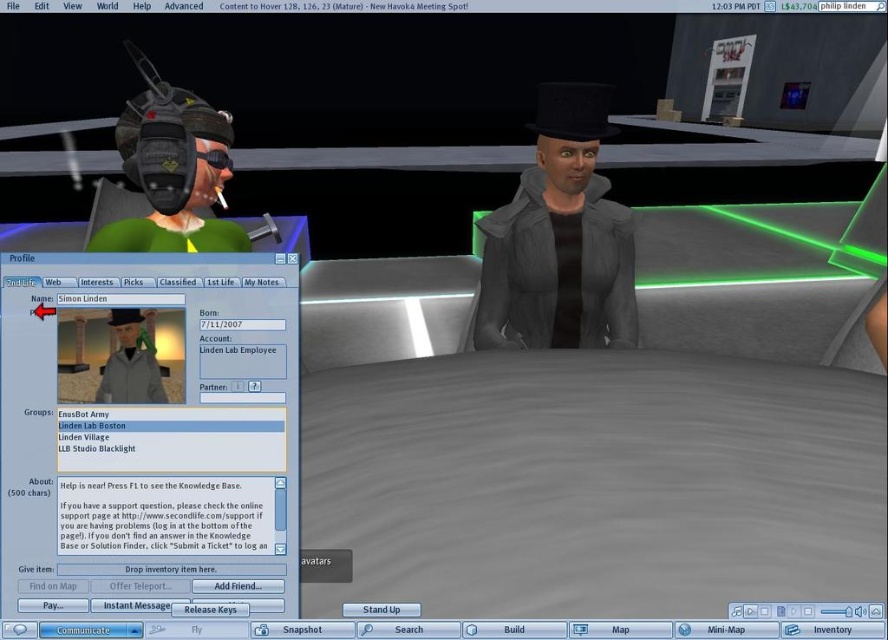
Find the location of a particular element. Image resolution: width=888 pixels, height=640 pixels. matte gray profile window at center left is located at coordinates (149, 454).

Is matte gray profile window at center left above matte black helmet at upper left?

Incorrect, matte gray profile window at center left is not positioned above matte black helmet at upper left.

I want to click on matte gray profile window at center left, so click(x=149, y=454).

The width and height of the screenshot is (888, 640). In order to click on matte gray profile window at center left in this screenshot , I will do pos(149,454).

Which is in front, point (160, 221) or point (123, 348)?

Positioned in front is point (123, 348).

Can you confirm if matte black helmet at upper left is positioned above gray matte jacket at center?

Correct, matte black helmet at upper left is located above gray matte jacket at center.

Find the location of a particular element. Image resolution: width=888 pixels, height=640 pixels. matte black helmet at upper left is located at coordinates (180, 182).

Does matte gray jacket at center appear under gray matte jacket at center?

No.

Between point (556, 260) and point (124, 364), which one is positioned in front?

Point (124, 364)

Where is `matte gray jacket at center`? The width and height of the screenshot is (888, 640). matte gray jacket at center is located at coordinates (559, 240).